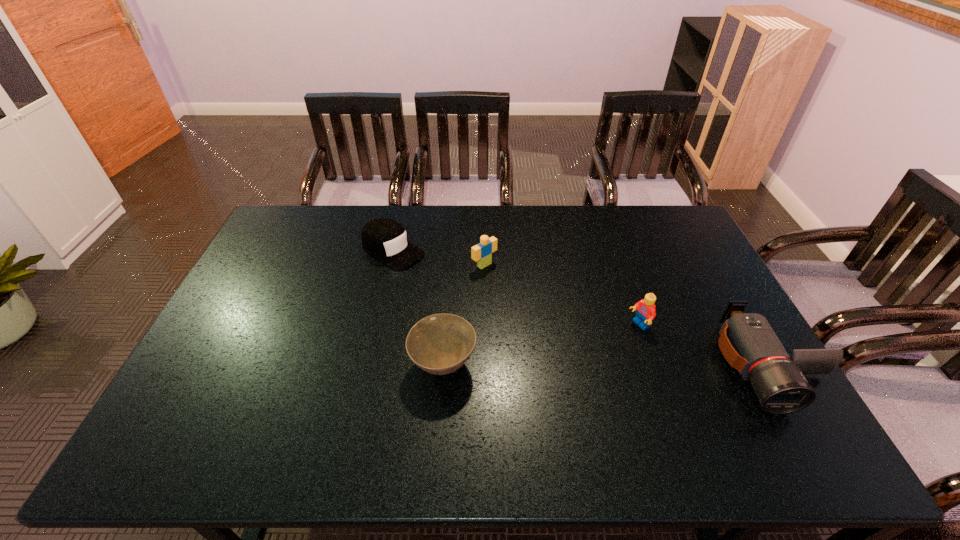
The height and width of the screenshot is (540, 960). Identify the location of bowl. (439, 344).

Where is `camcorder`? Image resolution: width=960 pixels, height=540 pixels. camcorder is located at coordinates (x=747, y=341).

Where is `the fourth object from left to right`? This screenshot has width=960, height=540. the fourth object from left to right is located at coordinates (646, 312).

The image size is (960, 540). What are the coordinates of `the right Lego` in the screenshot? It's located at (646, 312).

Identify the location of the farther Lego. The image size is (960, 540). (482, 253).

This screenshot has width=960, height=540. Identify the location of the leftmost object. (385, 239).

Find the location of `blank space located 0.120m on the back of the bowl`. blank space located 0.120m on the back of the bowl is located at coordinates (447, 308).

Find the location of a particular element. Image resolution: width=960 pixels, height=540 pixels. free space located on the face of the right Lego is located at coordinates (516, 390).

What are the coordinates of `free space located 0.130m on the face of the right Lego` in the screenshot? It's located at (597, 348).

The height and width of the screenshot is (540, 960). I want to click on vacant space situated 0.260m on the face of the right Lego, so click(x=560, y=368).